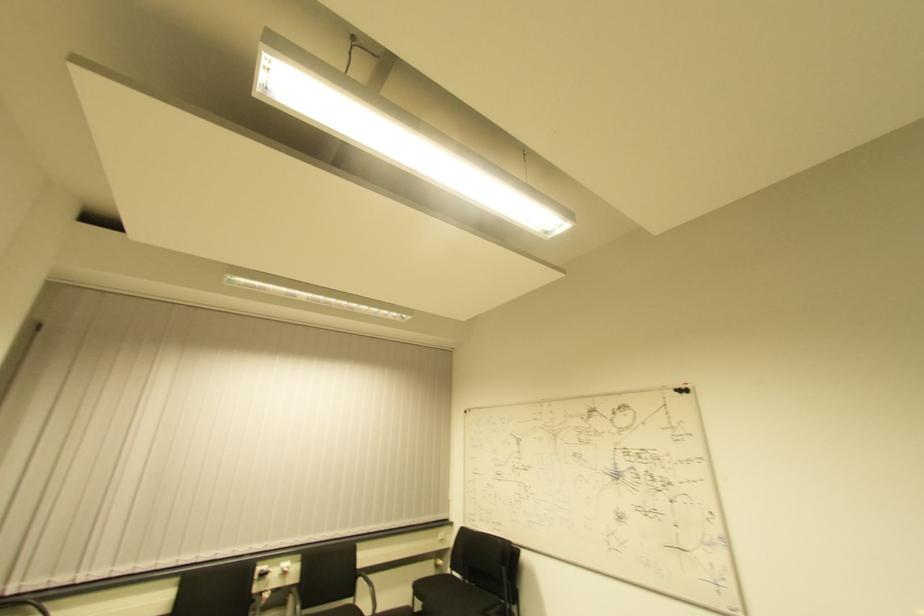
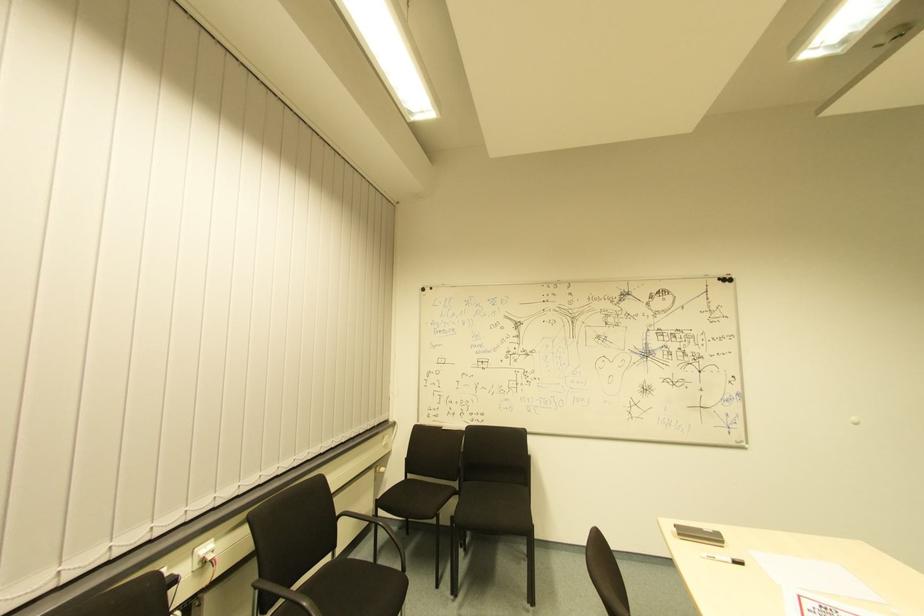
Where in the second image is the point corresponding to the point at 682,397 from the first image?

(725, 286)